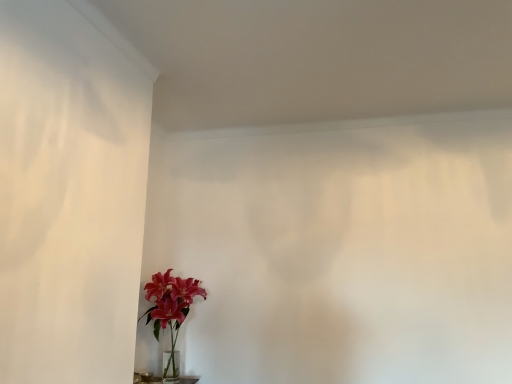
What do you see at coordinates (170, 309) in the screenshot?
I see `pink glass vase at lower left` at bounding box center [170, 309].

Locate an element on the screen. The width and height of the screenshot is (512, 384). pink glass vase at lower left is located at coordinates (170, 309).

Locate an element on the screen. The height and width of the screenshot is (384, 512). pink glass vase at lower left is located at coordinates (170, 309).